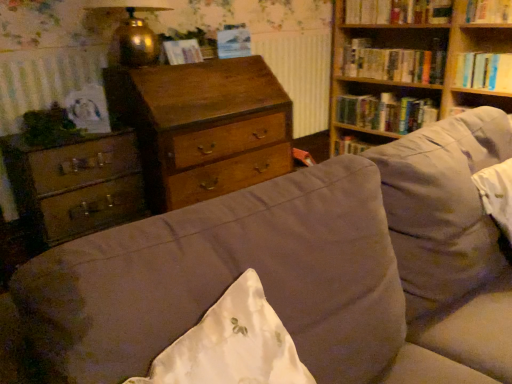
Question: From the image's perspective, is hardcover book at upper right, which appears as the third book when viewed from the top, under suede-like beige couch at center?

Choices:
 (A) no
 (B) yes

Answer: (A)

Question: Is the depth of hardcover book at upper right, placed as the 2th book when sorted from bottom to top, greater than that of suede-like beige couch at center?

Choices:
 (A) yes
 (B) no

Answer: (A)

Question: From a real-world perspective, is hardcover book at upper right, which appears as the third book when viewed from the top, over suede-like beige couch at center?

Choices:
 (A) yes
 (B) no

Answer: (A)

Question: Can you see hardcover book at upper right, which appears as the third book when viewed from the top, touching suede-like beige couch at center?

Choices:
 (A) no
 (B) yes

Answer: (A)

Question: Is hardcover book at upper right, placed as the 2th book when sorted from bottom to top, taller than suede-like beige couch at center?

Choices:
 (A) yes
 (B) no

Answer: (B)

Question: From the image's perspective, is hardcover book at upper right, placed as the 2th book when sorted from bottom to top, positioned above or below suede-like beige couch at center?

Choices:
 (A) below
 (B) above

Answer: (B)

Question: In terms of width, does hardcover book at upper right, placed as the 2th book when sorted from bottom to top, look wider or thinner when compared to suede-like beige couch at center?

Choices:
 (A) thin
 (B) wide

Answer: (A)

Question: From a real-world perspective, is hardcover book at upper right, which appears as the third book when viewed from the top, above or below suede-like beige couch at center?

Choices:
 (A) above
 (B) below

Answer: (A)

Question: Considering the positions of hardcover book at upper right, which appears as the third book when viewed from the top, and suede-like beige couch at center in the image, is hardcover book at upper right, which appears as the third book when viewed from the top, bigger or smaller than suede-like beige couch at center?

Choices:
 (A) big
 (B) small

Answer: (B)

Question: Is wooden chest of drawers at left, acting as the 1th chest of drawers starting from the left, taller or shorter than wooden bookshelf at upper right?

Choices:
 (A) short
 (B) tall

Answer: (A)

Question: Visually, is wooden chest of drawers at left, acting as the 1th chest of drawers starting from the left, positioned to the left or to the right of wooden bookshelf at upper right?

Choices:
 (A) right
 (B) left

Answer: (B)

Question: In terms of width, does wooden chest of drawers at left, acting as the 1th chest of drawers starting from the left, look wider or thinner when compared to wooden bookshelf at upper right?

Choices:
 (A) wide
 (B) thin

Answer: (B)

Question: Looking at the image, does wooden chest of drawers at left, acting as the 1th chest of drawers starting from the left, seem bigger or smaller compared to wooden bookshelf at upper right?

Choices:
 (A) small
 (B) big

Answer: (A)

Question: Is suede-like beige couch at center bigger or smaller than matte paper at upper center, which appears as the second paperback book when viewed from the left?

Choices:
 (A) small
 (B) big

Answer: (B)

Question: Considering the positions of suede-like beige couch at center and matte paper at upper center, which is counted as the second paperback book, starting from the front, in the image, is suede-like beige couch at center wider or thinner than matte paper at upper center, which is counted as the second paperback book, starting from the front,?

Choices:
 (A) wide
 (B) thin

Answer: (A)